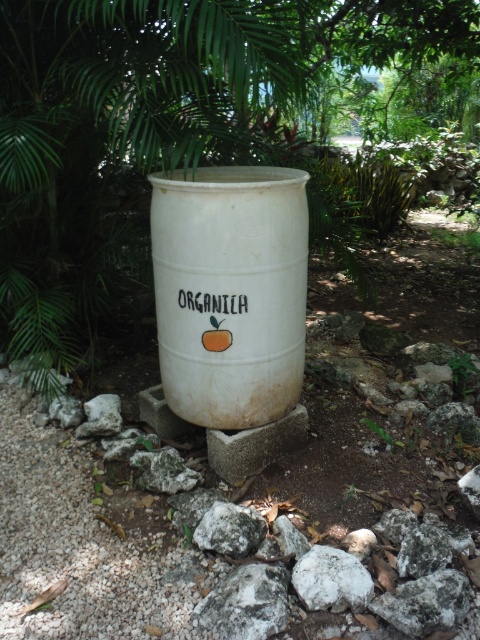
Does white matte rock at center have a lesser width compared to white rough rock at center?

Yes.

Which of these two, white matte rock at center or white rough rock at center, stands taller?

Standing taller between the two is white rough rock at center.

At what (x,y) coordinates should I click in order to perform the action: click on white matte rock at center. Please return your answer as a coordinate pair (x, y). This screenshot has height=640, width=480. Looking at the image, I should click on (332, 580).

Is green leafy tree at upper center above white matte rock at center?

Yes, green leafy tree at upper center is above white matte rock at center.

Can you confirm if green leafy tree at upper center is thinner than white matte rock at center?

Incorrect, green leafy tree at upper center's width is not less than white matte rock at center's.

Who is more forward, [24,0] or [312,572]?

Point [312,572] is in front.

Find the location of a particular element. The width and height of the screenshot is (480, 640). green leafy tree at upper center is located at coordinates (163, 125).

Which is more to the left, green leafy tree at upper center or white rough rock at center?

green leafy tree at upper center

Which is behind, point (24, 337) or point (216, 525)?

The point (24, 337) is more distant.

The height and width of the screenshot is (640, 480). What are the coordinates of `green leafy tree at upper center` in the screenshot? It's located at (163, 125).